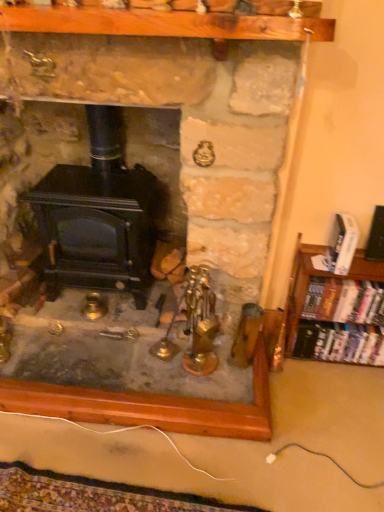
At what (x,y) coordinates should I click in order to perform the action: click on blank space situated above hardcover books at right, which appears as the 2th book when ordered from the bottom (from a real-world perspective). Please return your answer as a coordinate pair (x, y). The width and height of the screenshot is (384, 512). Looking at the image, I should click on (352, 281).